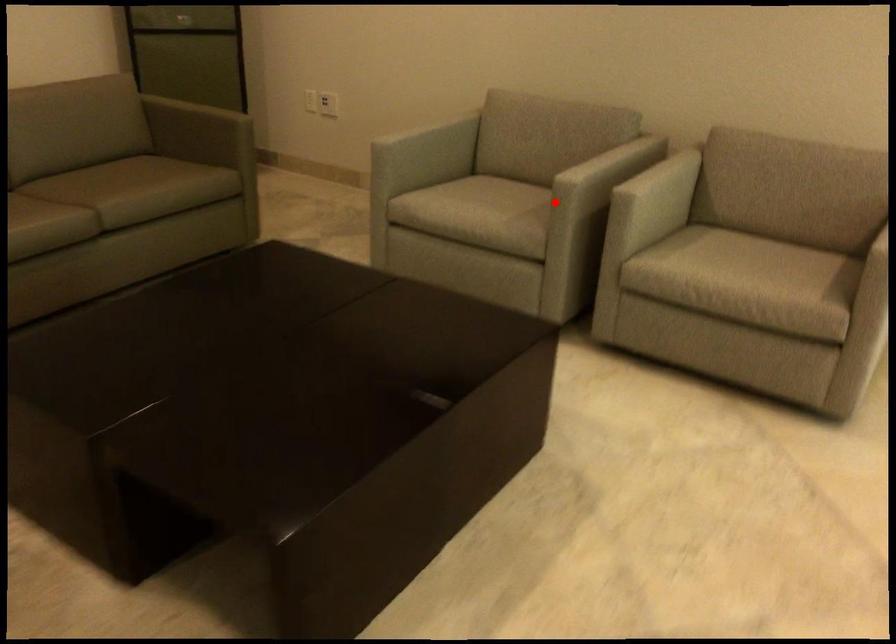
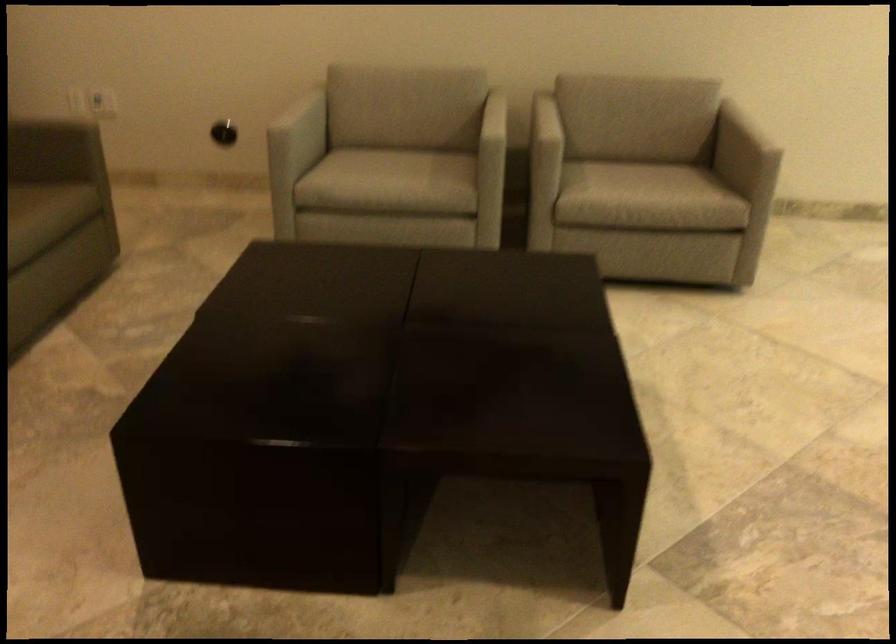
The point at the highlighted location is marked in the first image. Where is the corresponding point in the second image?

(492, 151)